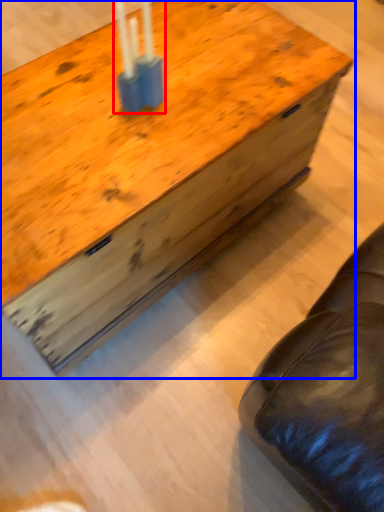
Question: Which of the following is the farthest to the observer, candle holder (highlighted by a red box) or table (highlighted by a blue box)?

Choices:
 (A) candle holder
 (B) table

Answer: (A)